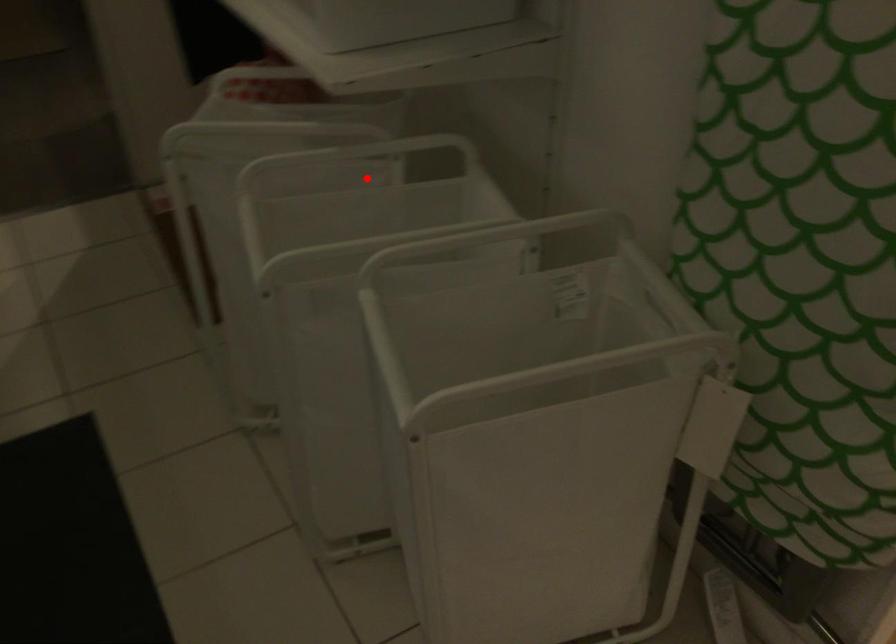
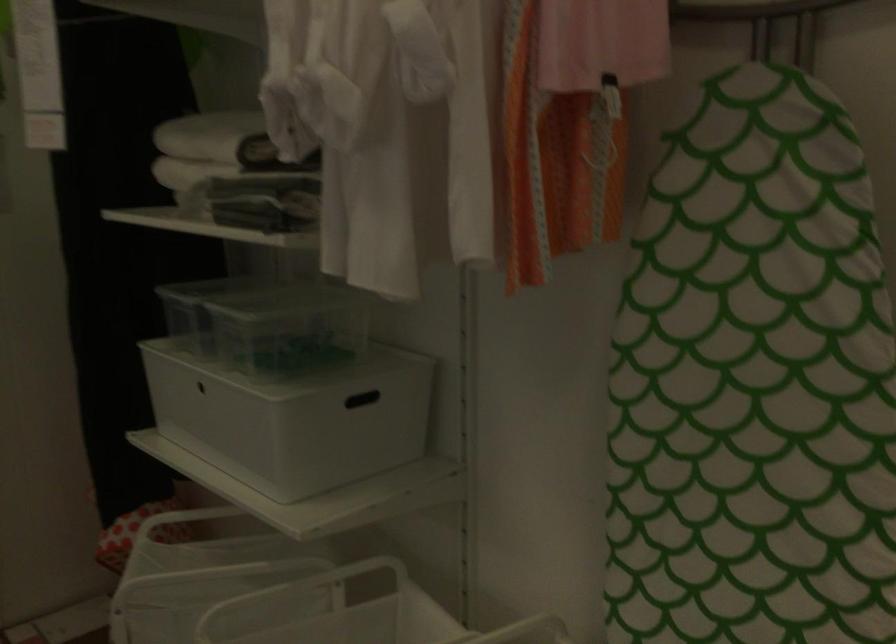
Question: I am providing you with two images of the same scene from different viewpoints. A red point is marked on the first image. Can you still see the location of the red point in image 2?

Choices:
 (A) Yes
 (B) No

Answer: (A)